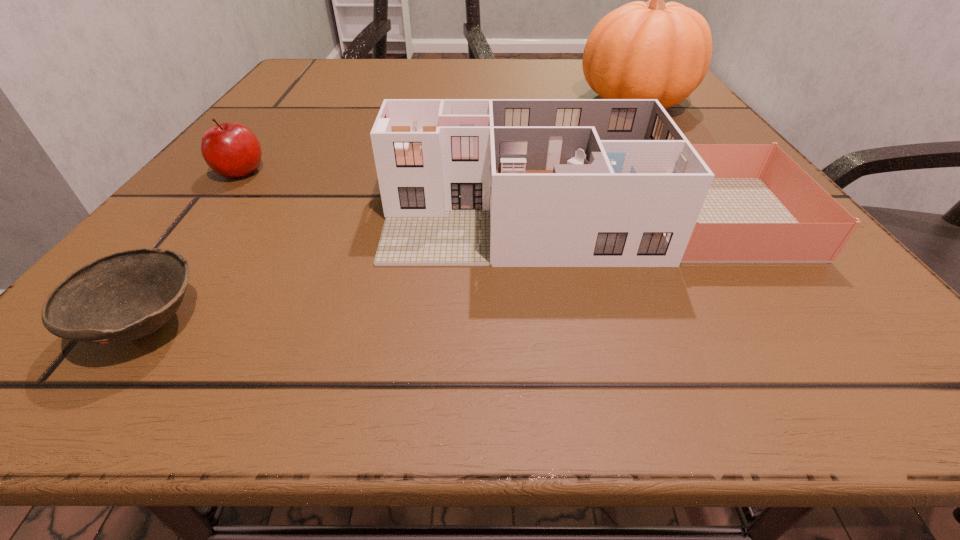
Select which object appears as the closest to the pumpkin. Please provide its 2D coordinates. Your answer should be formatted as a tuple, i.e. [(x, y)], where the tuple contains the x and y coordinates of a point satisfying the conditions above.

[(464, 182)]

I want to click on object that is the second closest to the farthest object, so pos(230,149).